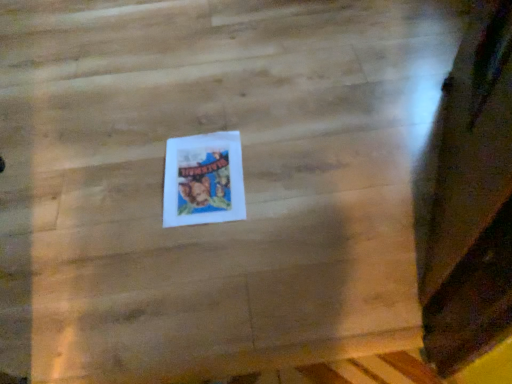
Describe the element at coordinates (203, 180) in the screenshot. I see `white paper poster at center` at that location.

Image resolution: width=512 pixels, height=384 pixels. In order to click on white paper poster at center in this screenshot , I will do `click(203, 180)`.

Locate an element on the screen. The height and width of the screenshot is (384, 512). white paper poster at center is located at coordinates point(203,180).